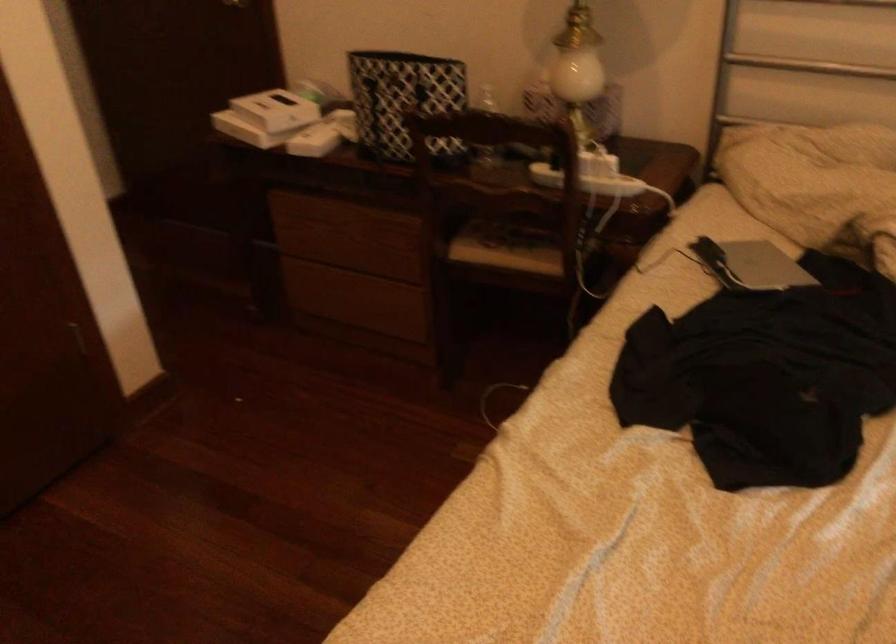
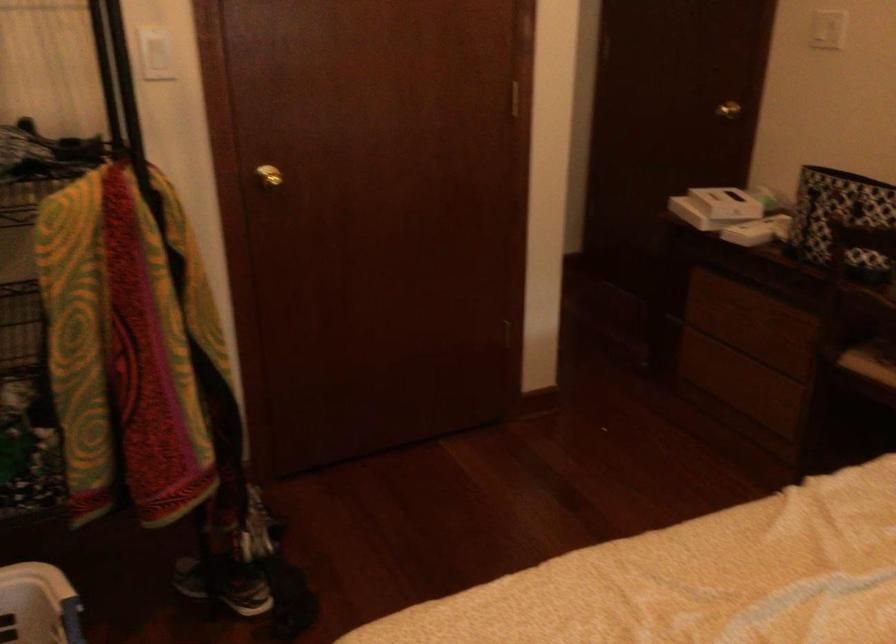
In the second image, find the point that corresponds to (x=423, y=109) in the first image.

(840, 218)